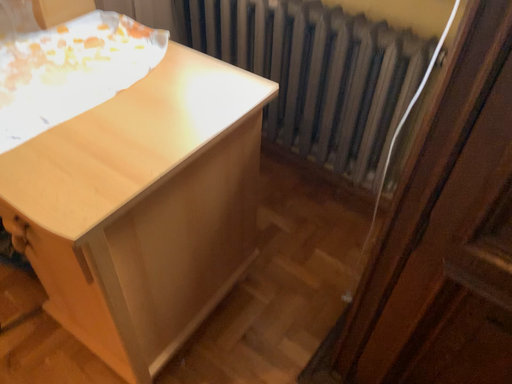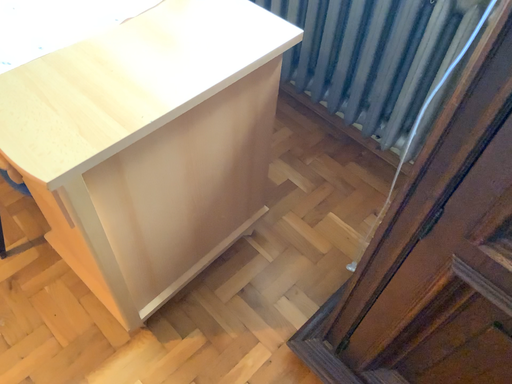
Question: How did the camera likely rotate when shooting the video?

Choices:
 (A) rotated downward
 (B) rotated upward

Answer: (A)